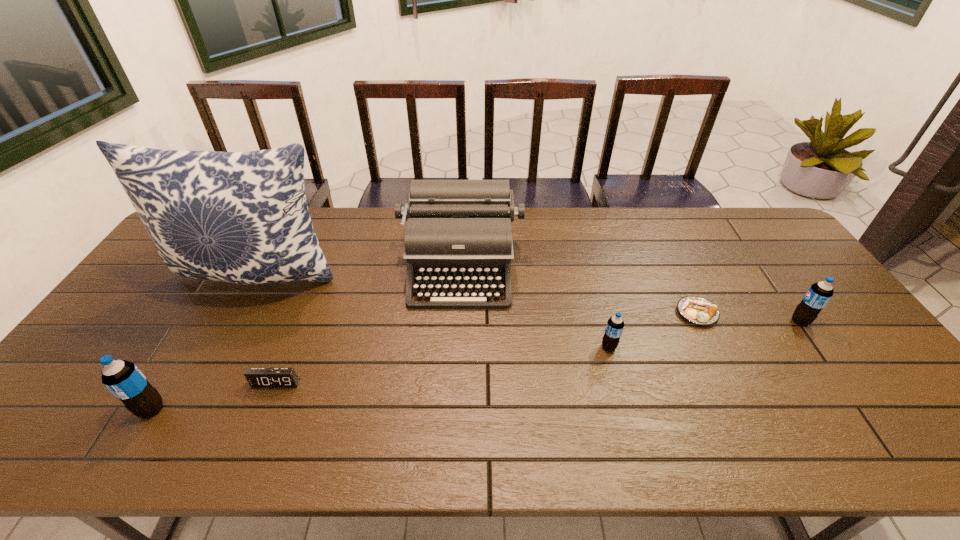
You are a GUI agent. You are given a task and a screenshot of the screen. Output one action in this format:
    pyautogui.click(x=<x>, y=<y>)
    Task: Click on the nearest object
    The image size is (960, 540).
    Given the screenshot: What is the action you would take?
    pyautogui.click(x=123, y=379)

Where is `the nearest soda bottle`? The height and width of the screenshot is (540, 960). the nearest soda bottle is located at coordinates (123, 379).

Locate an element on the screen. The image size is (960, 540). the fifth farthest object is located at coordinates (615, 325).

You are a GUI agent. You are given a task and a screenshot of the screen. Output one action in this format:
    pyautogui.click(x=<x>, y=<y>)
    Task: Click on the second nearest soda bottle
    
    Given the screenshot: What is the action you would take?
    pyautogui.click(x=615, y=325)

This screenshot has height=540, width=960. Identify the location of the second shortest soda bottle. (819, 294).

Locate an element on the screen. the farthest soda bottle is located at coordinates (819, 294).

At what (x,y) coordinates should I click in order to perform the action: click on typewriter. Please return your answer as a coordinate pair (x, y). The width and height of the screenshot is (960, 540). Looking at the image, I should click on (458, 231).

Find the location of a particular element. Image resolution: width=960 pixels, height=540 pixels. cushion is located at coordinates (241, 217).

Locate an element on the screen. This screenshot has width=960, height=540. pastry is located at coordinates (700, 311).

The image size is (960, 540). Identify the location of the sixth object from left to right. (700, 311).